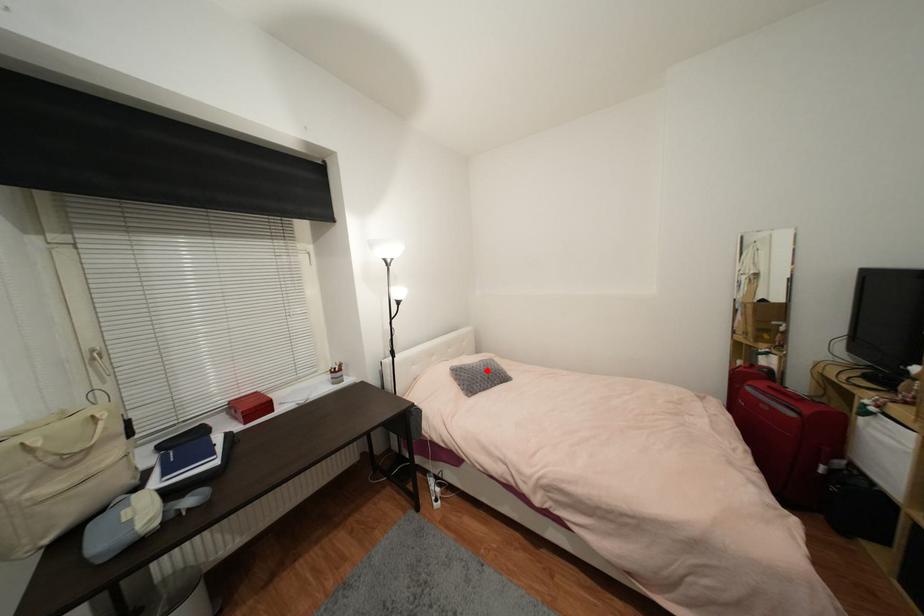
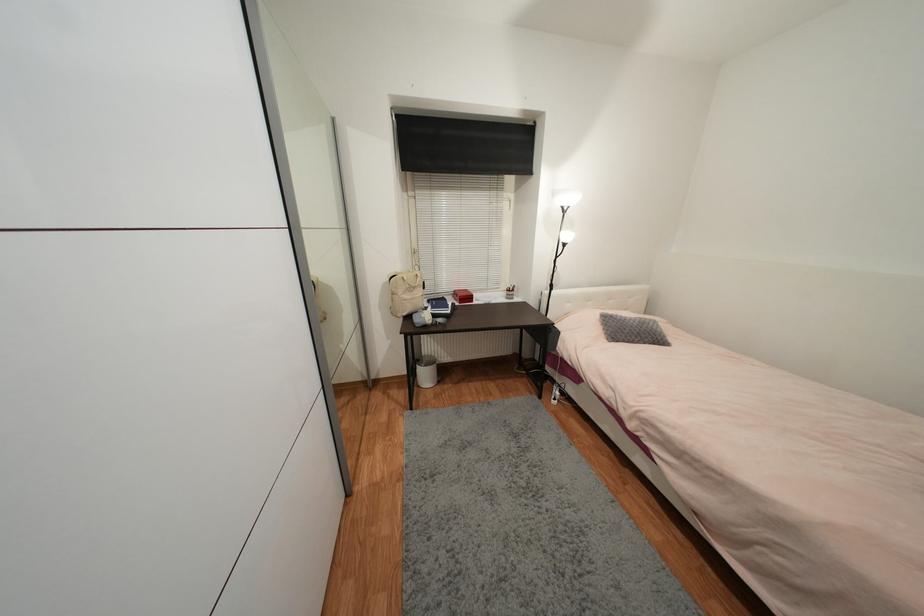
Find the pixel in the second image that matches the highlighted location in the first image.

(639, 326)